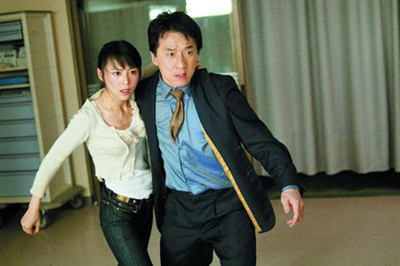
Locate an element on the screen. floor is located at coordinates (343, 242), (63, 248).